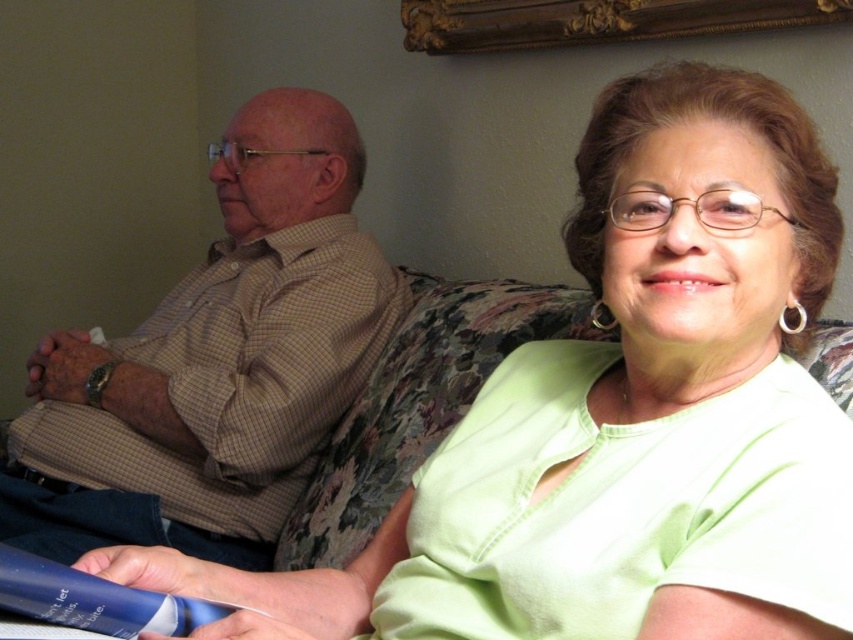
Does brown checkered shirt at left appear over blue plastic tube at lower left?

Indeed, brown checkered shirt at left is positioned over blue plastic tube at lower left.

Between point (190, 483) and point (32, 593), which one is positioned in front?

Point (32, 593) is in front.

I want to click on brown checkered shirt at left, so click(215, 362).

Describe the element at coordinates (215, 362) in the screenshot. The height and width of the screenshot is (640, 853). I see `brown checkered shirt at left` at that location.

Does brown checkered shirt at left have a greater height compared to gold ornate picture frame at upper center?

Yes.

Is point (44, 342) positioned before point (804, 22)?

No, (44, 342) is behind (804, 22).

I want to click on brown checkered shirt at left, so click(x=215, y=362).

Is point (628, 6) closer to camera compared to point (19, 579)?

No, it is behind (19, 579).

You are a GUI agent. You are given a task and a screenshot of the screen. Output one action in this format:
    pyautogui.click(x=<x>, y=<y>)
    Task: Click on the gold ornate picture frame at upper center
    
    Given the screenshot: What is the action you would take?
    pyautogui.click(x=595, y=20)